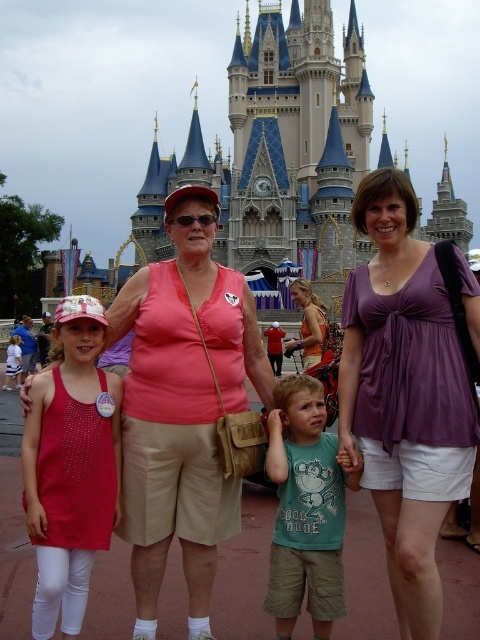
Question: Among these points, which one is farthest from the camera?

Choices:
 (A) (297, 387)
 (B) (441, 228)
 (C) (302, 305)
 (D) (388, 305)

Answer: (B)

Question: Which point is closer to the camera taking this photo?

Choices:
 (A) (316, 326)
 (B) (280, 612)
 (C) (410, 392)
 (D) (375, 262)

Answer: (B)

Question: Is pink fabric shirt at center above purple fabric blouse at center?

Choices:
 (A) yes
 (B) no

Answer: (B)

Question: Is purple fabric blouse at center further to the viewer compared to orange fabric dress at center?

Choices:
 (A) yes
 (B) no

Answer: (B)

Question: Is blue stone castle at center above teal cotton shirt at center?

Choices:
 (A) yes
 (B) no

Answer: (A)

Question: Among these points, which one is nearest to the camera?

Choices:
 (A) (432, 548)
 (B) (308, 292)
 (C) (163, 540)
 (D) (313, 179)

Answer: (A)